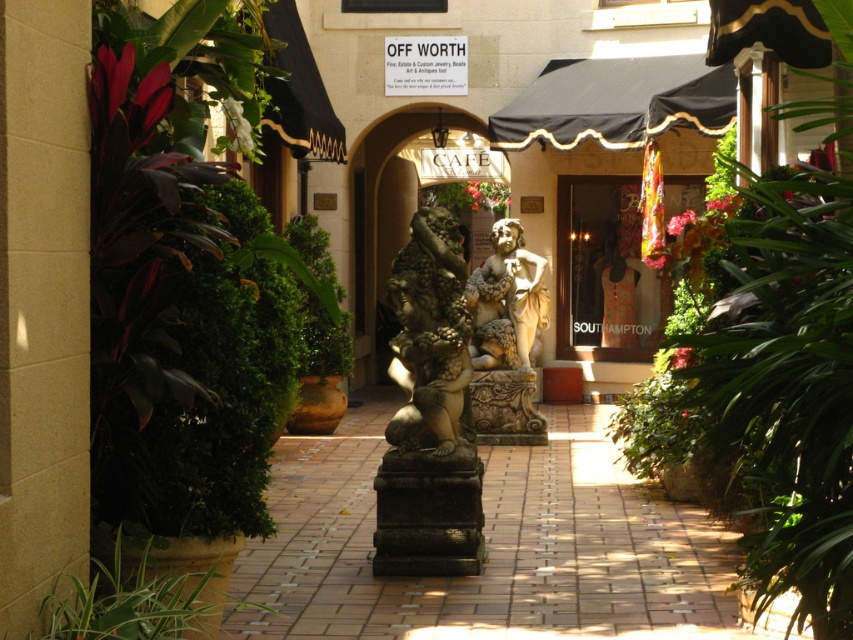
Based on the photo, you are standing in the outdoor shopping area and want to take a photo of both the decorative stone sculpture and the lush greenery. You notice two points marked as point 1 at coordinates point (463, 220) and point 2 at coordinates point (306, 353). Which point should you stand closer to in order to ensure both the sculpture and the greenery are in frame?

You should stand closer to point (463, 220) because it is closer to the camera, allowing you to capture both the decorative stone sculpture and the lush greenery in the frame.

You are a visitor walking along the tiled walkway in the outdoor shopping area. You see the green leafy plant at lower left and the marble statue at center. Which object is nearer to you as you walk past them?

The green leafy plant at lower left is closer to the viewer than the marble statue at center, so the green leafy plant at lower left is nearer to you as you walk past them.